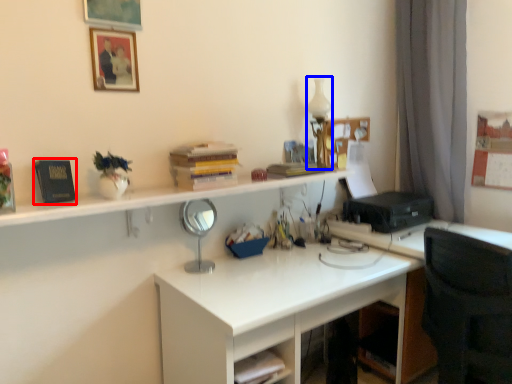
Question: Which object is further to the camera taking this photo, book (highlighted by a red box) or table lamp (highlighted by a blue box)?

Choices:
 (A) book
 (B) table lamp

Answer: (B)